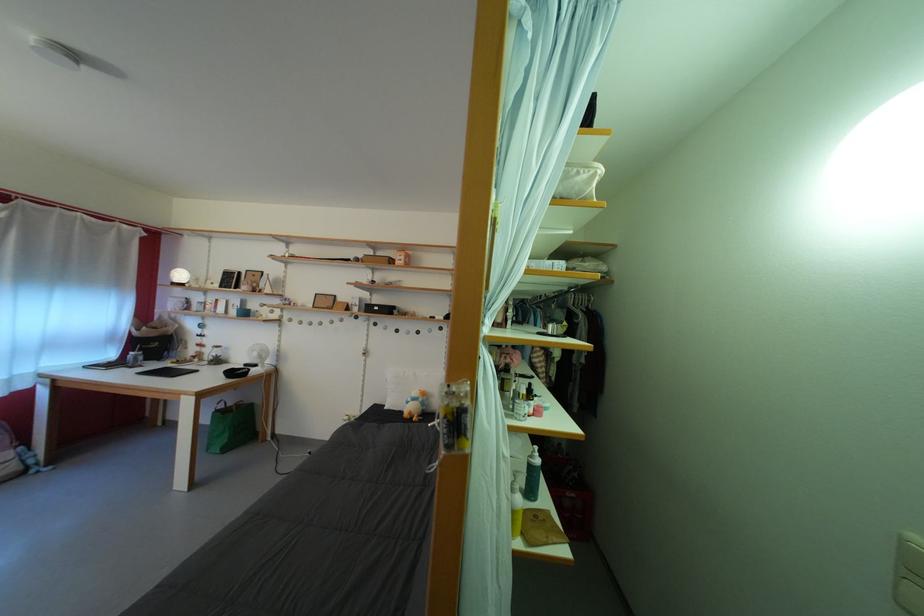
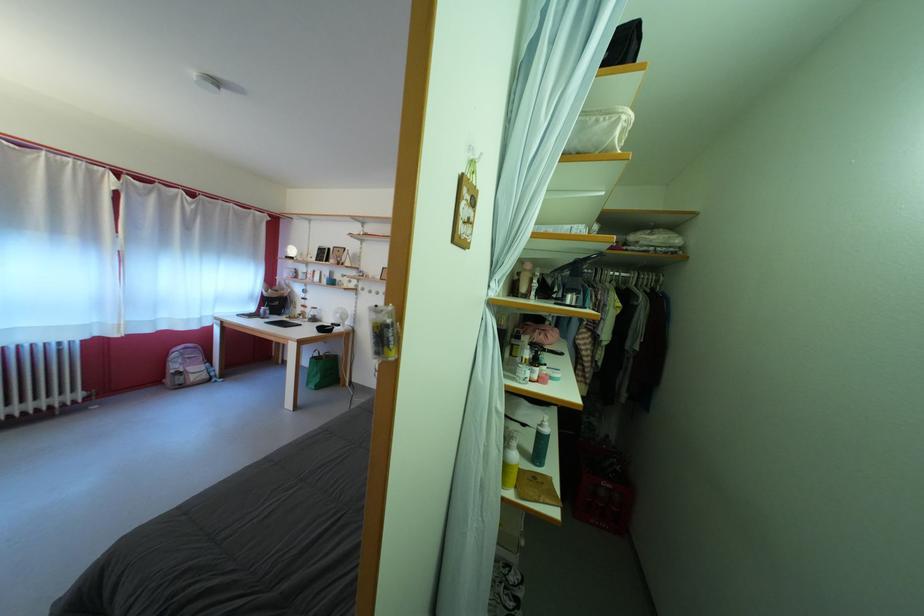
Find the pixel in the second image that matches (226,368) in the first image.

(322, 325)